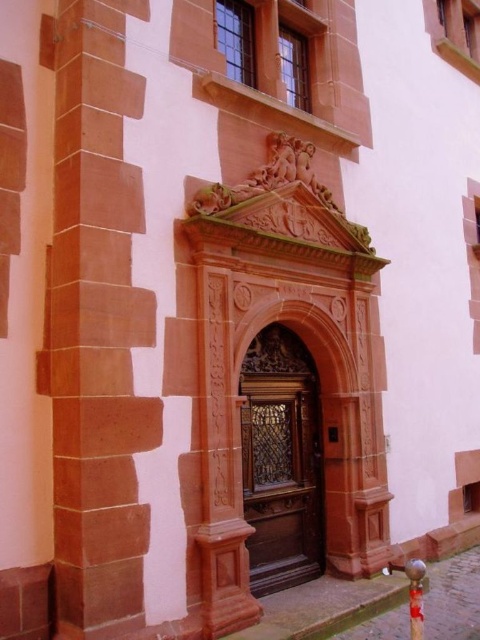
Is red stone pillar at left shorter than shiny metallic pole at center?

Incorrect, red stone pillar at left's height does not fall short of shiny metallic pole at center's.

Does point (104, 81) come closer to viewer compared to point (420, 612)?

No, (104, 81) is further to viewer.

This screenshot has width=480, height=640. I want to click on red stone pillar at left, so click(96, 328).

Does brown carved wood door at center have a smaller size compared to shiny metallic pole at center?

Actually, brown carved wood door at center might be larger than shiny metallic pole at center.

Is brown carved wood door at center to the right of shiny metallic pole at center from the viewer's perspective?

Incorrect, brown carved wood door at center is not on the right side of shiny metallic pole at center.

Measure the distance between point (252, 547) and camera.

They are 7.73 meters apart.

Where is `brown carved wood door at center`? The height and width of the screenshot is (640, 480). brown carved wood door at center is located at coordinates (282, 480).

Does red stone pillar at left come in front of brown carved wood door at center?

Yes, it is in front of brown carved wood door at center.

Does red stone pillar at left appear over brown carved wood door at center?

Indeed, red stone pillar at left is positioned over brown carved wood door at center.

Is point (96, 486) farther from camera compared to point (292, 444)?

No, (96, 486) is closer to viewer.

Where is `red stone pillar at left`? The width and height of the screenshot is (480, 640). red stone pillar at left is located at coordinates pos(96,328).